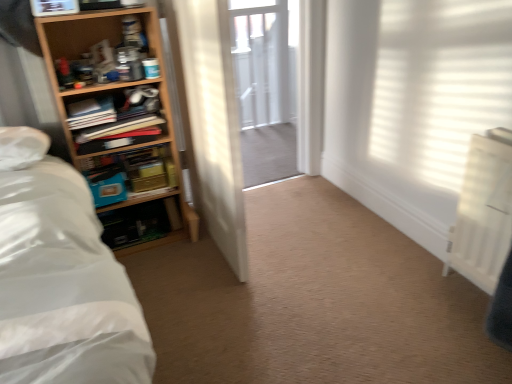
Question: Considering the relative sizes of clear glass screen door at center and wooden bookshelf at left, positioned as the 1th shelf in bottom-to-top order, in the image provided, is clear glass screen door at center wider than wooden bookshelf at left, positioned as the 1th shelf in bottom-to-top order,?

Choices:
 (A) yes
 (B) no

Answer: (A)

Question: Does clear glass screen door at center lie in front of wooden bookshelf at left, positioned as the 1th shelf in bottom-to-top order?

Choices:
 (A) yes
 (B) no

Answer: (B)

Question: Is the depth of clear glass screen door at center greater than that of wooden bookshelf at left, positioned as the third shelf in top-to-bottom order?

Choices:
 (A) yes
 (B) no

Answer: (A)

Question: Can you confirm if clear glass screen door at center is thinner than wooden bookshelf at left, positioned as the 1th shelf in bottom-to-top order?

Choices:
 (A) yes
 (B) no

Answer: (B)

Question: From the image's perspective, is clear glass screen door at center above wooden bookshelf at left, positioned as the 1th shelf in bottom-to-top order?

Choices:
 (A) no
 (B) yes

Answer: (B)

Question: Does clear glass screen door at center appear on the left side of wooden bookshelf at left, positioned as the 1th shelf in bottom-to-top order?

Choices:
 (A) no
 (B) yes

Answer: (A)

Question: From a real-world perspective, is wooden bookshelf at left, positioned as the 1th shelf in bottom-to-top order, positioned under wooden bookshelf at left, which is the second shelf in top-to-bottom order, based on gravity?

Choices:
 (A) no
 (B) yes

Answer: (B)

Question: From the image's perspective, is wooden bookshelf at left, positioned as the 1th shelf in bottom-to-top order, on wooden bookshelf at left, which is the second shelf in top-to-bottom order?

Choices:
 (A) yes
 (B) no

Answer: (B)

Question: Does wooden bookshelf at left, positioned as the 1th shelf in bottom-to-top order, lie behind wooden bookshelf at left, which is the second shelf in top-to-bottom order?

Choices:
 (A) no
 (B) yes

Answer: (B)

Question: Is wooden bookshelf at left, positioned as the third shelf in top-to-bottom order, beside wooden bookshelf at left, which is the second shelf in top-to-bottom order?

Choices:
 (A) no
 (B) yes

Answer: (A)

Question: Is wooden bookshelf at left, positioned as the third shelf in top-to-bottom order, smaller than wooden bookshelf at left, which is counted as the second shelf, starting from the bottom?

Choices:
 (A) yes
 (B) no

Answer: (A)

Question: Does wooden bookshelf at left, positioned as the third shelf in top-to-bottom order, have a lesser height compared to wooden bookshelf at left, which is the second shelf in top-to-bottom order?

Choices:
 (A) yes
 (B) no

Answer: (A)

Question: Can you confirm if wooden bookshelf at left, positioned as the 1th shelf in bottom-to-top order, is positioned to the left of clear glass screen door at center?

Choices:
 (A) no
 (B) yes

Answer: (B)